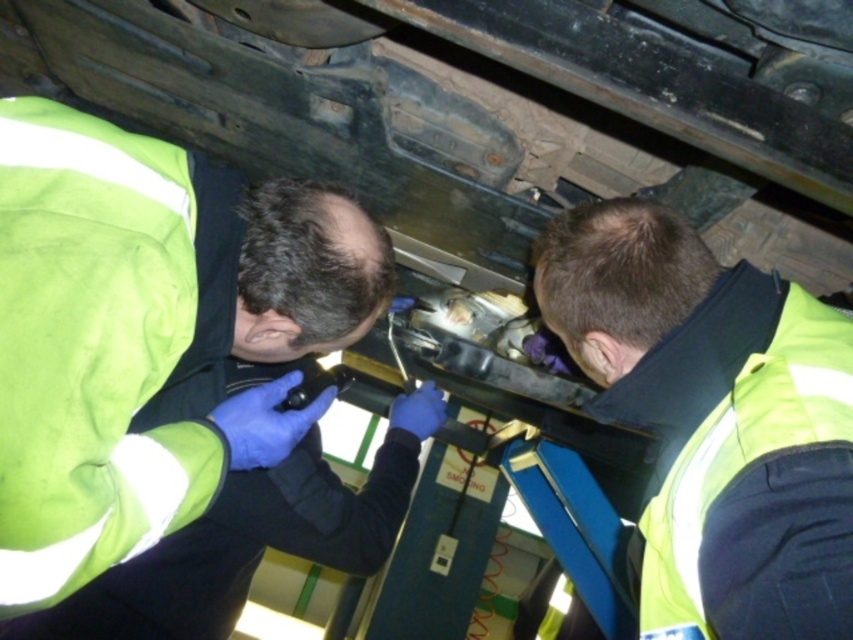
You are standing at the origin point of the coordinate system. There is a green reflective vest at center represented by point (148, 352). Can you tell me the coordinates of the green reflective vest at center?

The coordinates of the green reflective vest at center are point (148, 352).

You are a safety inspector checking the work area. You notice the green reflective vest at center and the yellow reflective vest at lower right. Which vest is closer to the front of the work area?

The green reflective vest at center is closer to the front of the work area because the yellow reflective vest at lower right is behind it.